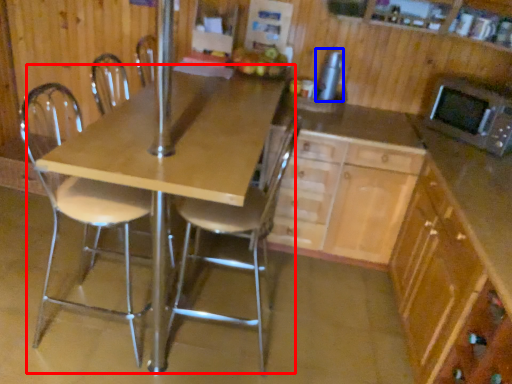
Question: Which of the following is the farthest to the observer, table (highlighted by a red box) or appliance (highlighted by a blue box)?

Choices:
 (A) table
 (B) appliance

Answer: (B)